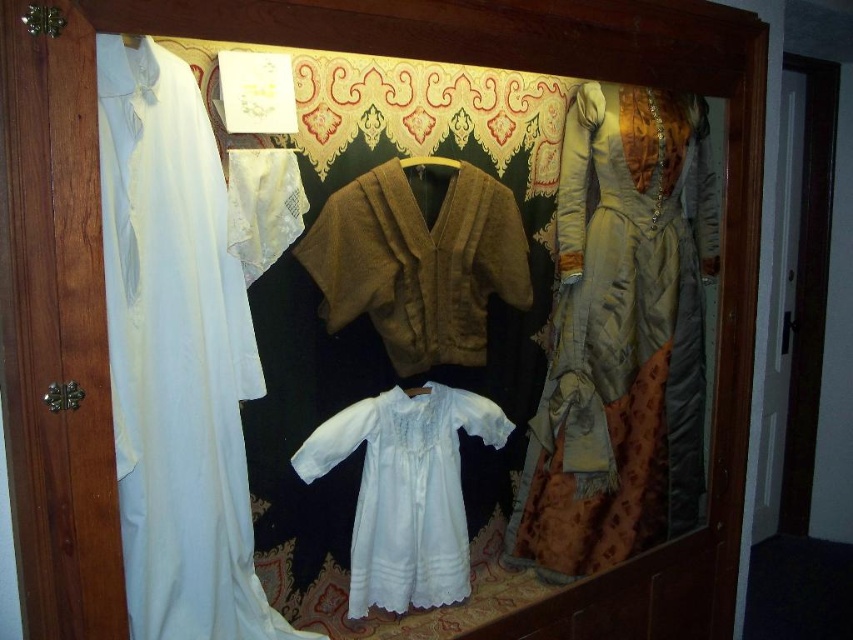
Does white cotton robe at left appear on the left side of silky beige gown at right?

Yes, white cotton robe at left is to the left of silky beige gown at right.

Which is below, white cotton robe at left or silky beige gown at right?

white cotton robe at left is lower down.

Between point (595, 564) and point (619, 416), which one is positioned in front?

Point (619, 416) is more forward.

Identify the location of white cotton robe at left. (300, 360).

Does point (163, 248) come behind point (552, 458)?

No.

Who is shorter, white satin dress at left or silky beige gown at right?

Standing shorter between the two is white satin dress at left.

In order to click on white satin dress at left in this screenshot , I will do `click(177, 356)`.

This screenshot has height=640, width=853. What are the coordinates of `white satin dress at left` in the screenshot? It's located at (177, 356).

Is white lace dress at center above brown fabric hanger at center?

No, white lace dress at center is not above brown fabric hanger at center.

Who is taller, white lace dress at center or brown fabric hanger at center?

With more height is white lace dress at center.

You are a GUI agent. You are given a task and a screenshot of the screen. Output one action in this format:
    pyautogui.click(x=<x>, y=<y>)
    Task: Click on the white lace dress at center
    
    Given the screenshot: What is the action you would take?
    pyautogui.click(x=405, y=492)

Where is `white lace dress at center`? The height and width of the screenshot is (640, 853). white lace dress at center is located at coordinates pos(405,492).